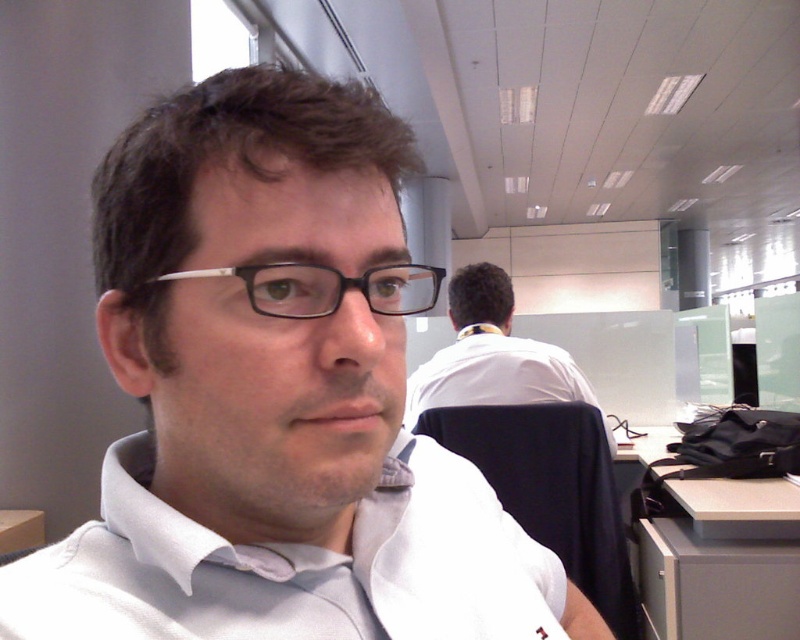
Question: Among these points, which one is nearest to the camera?

Choices:
 (A) (506, 298)
 (B) (368, 276)
 (C) (182, 515)
 (D) (708, 477)

Answer: (B)

Question: Which of the following is the farthest from the observer?

Choices:
 (A) white matte shirt at center
 (B) matte black glasses at center

Answer: (B)

Question: Can you confirm if white matte shirt at center is positioned to the left of white shirt at upper center?

Choices:
 (A) no
 (B) yes

Answer: (B)

Question: Can you confirm if white shirt at upper center is bigger than matte black glasses at center?

Choices:
 (A) yes
 (B) no

Answer: (A)

Question: Among these points, which one is farthest from the camera?

Choices:
 (A) (558, 355)
 (B) (426, 276)

Answer: (A)

Question: Is white cotton dress shirt at center smaller than matte black glasses at center?

Choices:
 (A) no
 (B) yes

Answer: (A)